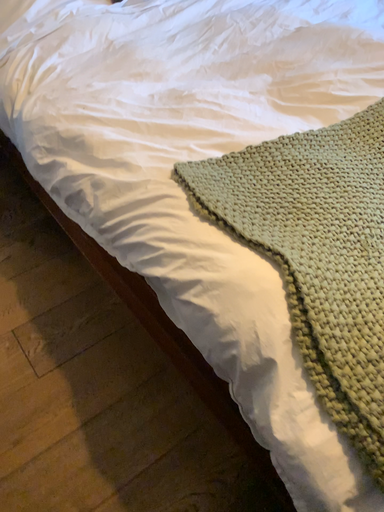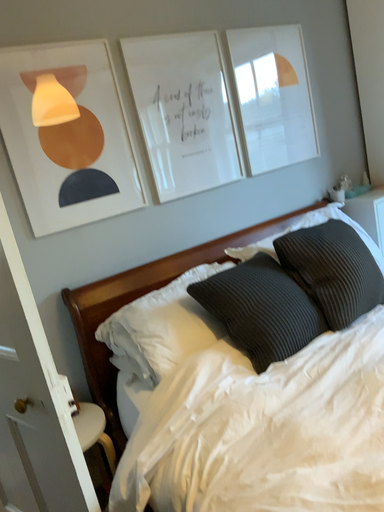
Question: Which way did the camera rotate in the video?

Choices:
 (A) rotated left
 (B) rotated right

Answer: (A)